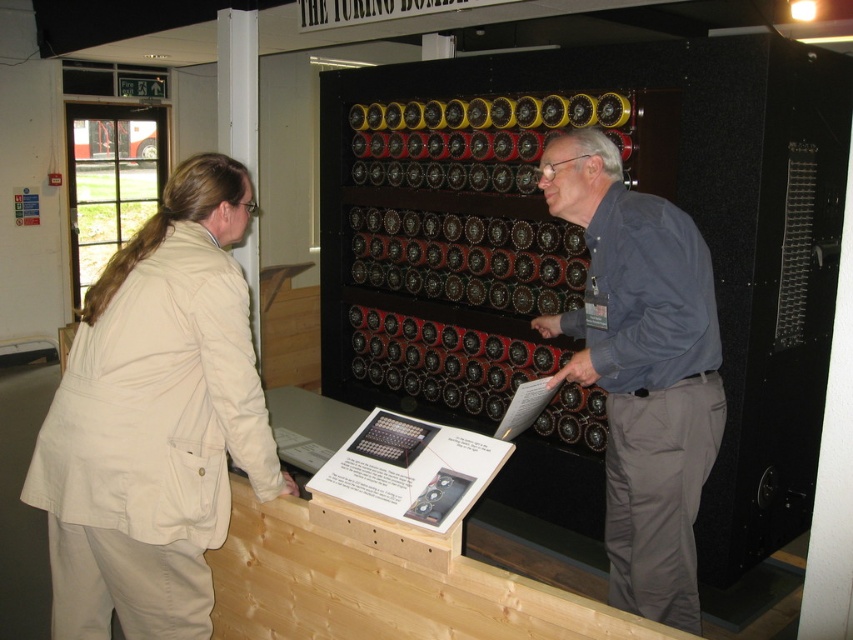
Question: Does beige fabric jacket at left have a smaller size compared to blue shirt at center?

Choices:
 (A) no
 (B) yes

Answer: (B)

Question: Does beige fabric jacket at left have a lesser width compared to blue shirt at center?

Choices:
 (A) no
 (B) yes

Answer: (A)

Question: Which point is farther to the camera?

Choices:
 (A) (94, 362)
 (B) (602, 164)

Answer: (B)

Question: Is beige fabric jacket at left positioned at the back of blue shirt at center?

Choices:
 (A) yes
 (B) no

Answer: (B)